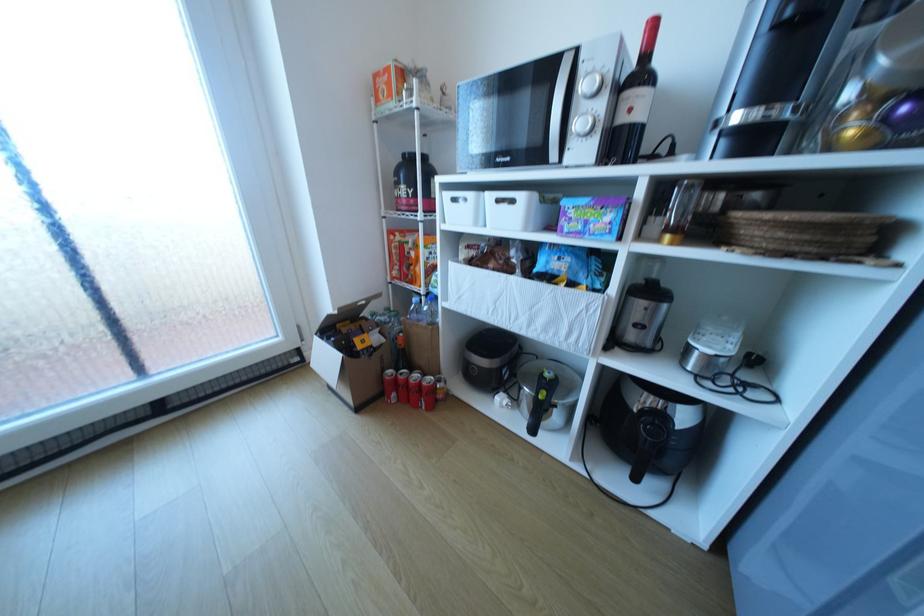
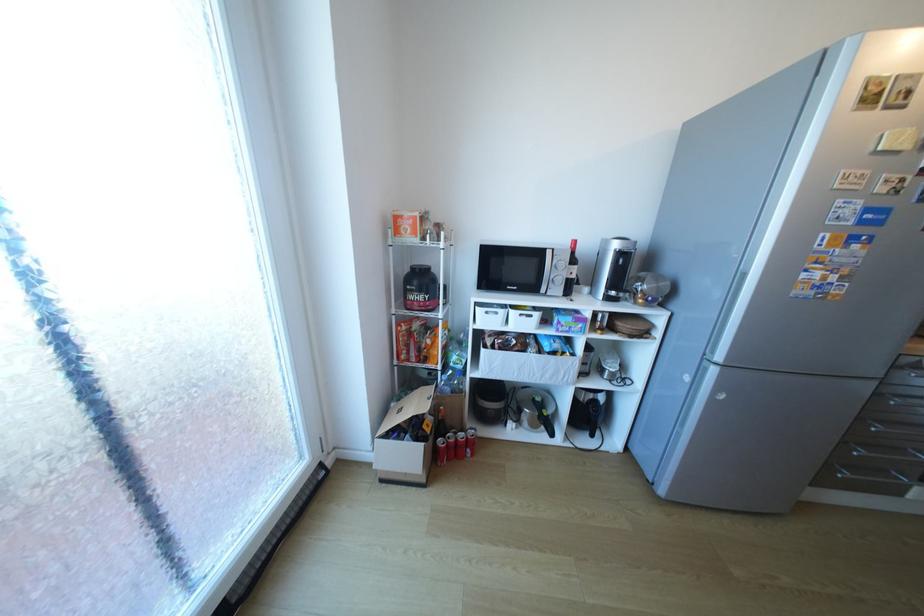
In the second image, find the point that corresponds to (464,201) in the first image.

(495, 313)